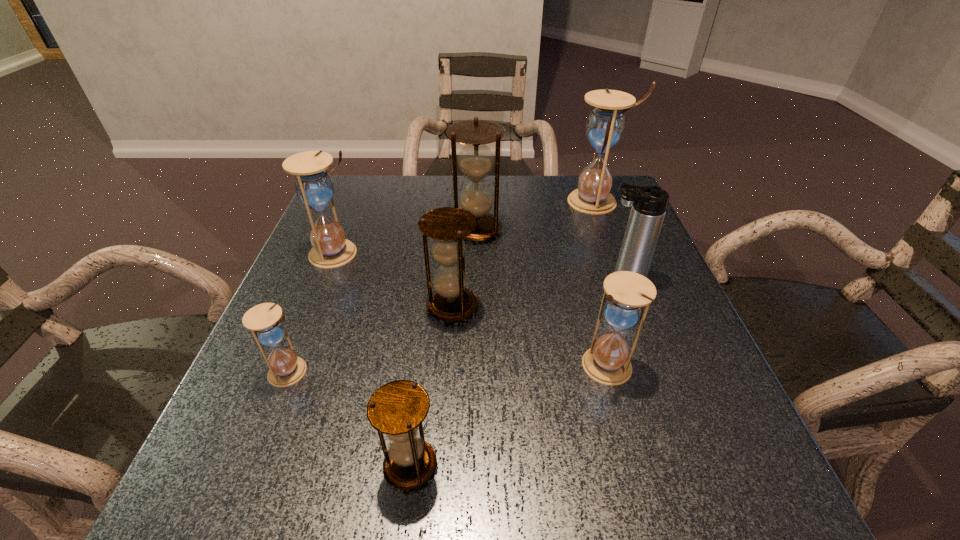
This screenshot has height=540, width=960. Find the location of `vacant space located on the right of the nearest hourglass`. vacant space located on the right of the nearest hourglass is located at coordinates (497, 465).

Locate an element on the screen. Image resolution: width=960 pixels, height=540 pixels. object positioned at the near edge is located at coordinates (397, 409).

Locate an element on the screen. Image resolution: width=960 pixels, height=540 pixels. thermos bottle located in the right edge section of the desktop is located at coordinates (649, 203).

This screenshot has height=540, width=960. In order to click on object present at the far right corner in this screenshot , I will do `click(605, 126)`.

Where is `vacant space at the far edge of the desktop`? vacant space at the far edge of the desktop is located at coordinates (557, 204).

Where is `free space at the near edge of the desktop`? free space at the near edge of the desktop is located at coordinates (512, 510).

At what (x,y) coordinates should I click in order to perform the action: click on vacant space at the left edge of the desktop. Please return your answer as a coordinate pair (x, y). Looking at the image, I should click on (244, 405).

You are a GUI agent. You are given a task and a screenshot of the screen. Output one action in this format:
    pyautogui.click(x=<x>, y=<y>)
    Task: Click on the vacant space at the right edge of the desktop
    The height and width of the screenshot is (540, 960).
    Given the screenshot: What is the action you would take?
    pyautogui.click(x=612, y=259)

This screenshot has height=540, width=960. In the image, there is a desktop. Identify the location of vacant area at the far left corner. (348, 207).

In the image, there is a desktop. Where is `vacant space at the far right corner`? Image resolution: width=960 pixels, height=540 pixels. vacant space at the far right corner is located at coordinates (621, 217).